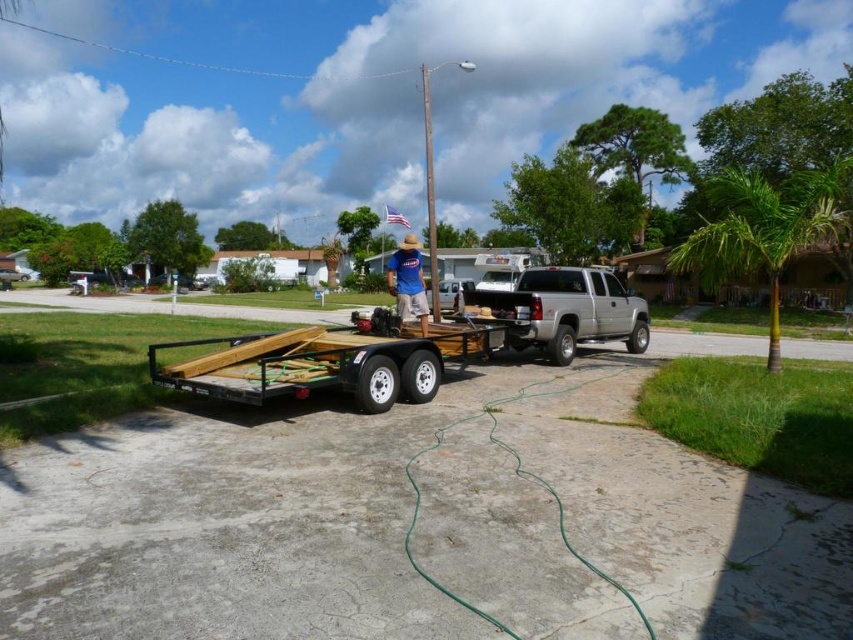
Question: Is metallic silver trailer at center wider than blue cotton shirt at center?

Choices:
 (A) yes
 (B) no

Answer: (B)

Question: Can you confirm if silver metallic pickup truck at center is positioned to the left of blue cotton shirt at center?

Choices:
 (A) no
 (B) yes

Answer: (A)

Question: Which is nearer to the blue cotton shirt at center?

Choices:
 (A) silver metallic pickup truck at center
 (B) metallic silver trailer at center

Answer: (B)

Question: Which of the following is the farthest from the observer?

Choices:
 (A) blue cotton shirt at center
 (B) silver metallic pickup truck at center
 (C) metallic silver trailer at center

Answer: (B)

Question: Which point is farther to the camera?

Choices:
 (A) (392, 278)
 (B) (273, 332)

Answer: (A)

Question: Can you confirm if silver metallic pickup truck at center is smaller than blue cotton shirt at center?

Choices:
 (A) yes
 (B) no

Answer: (A)